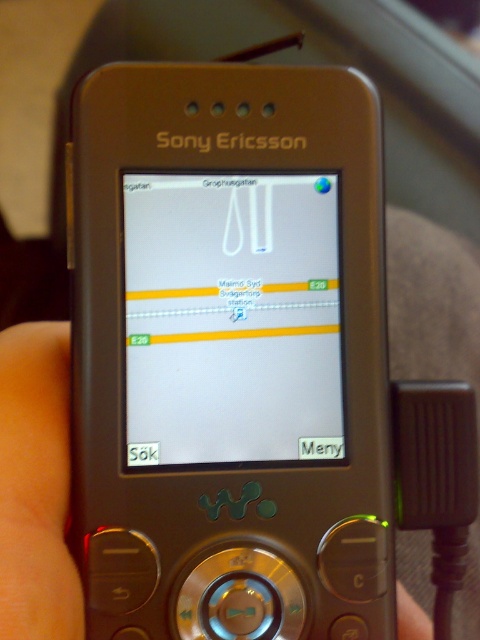
Which is above, matte silver screen at center or metallic silver phone at center?

matte silver screen at center

Locate an element on the screen. matte silver screen at center is located at coordinates (231, 317).